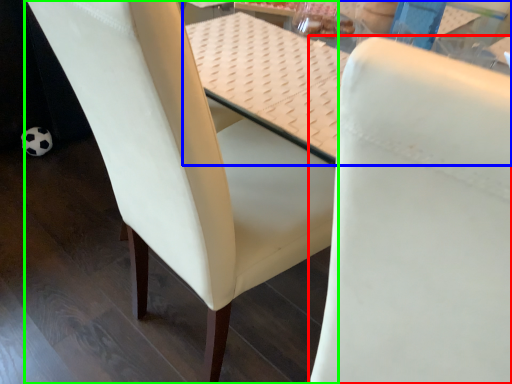
Question: Considering the real-world distances, which object is closest to chair (highlighted by a red box)? table (highlighted by a blue box) or chair (highlighted by a green box).

Choices:
 (A) table
 (B) chair

Answer: (B)